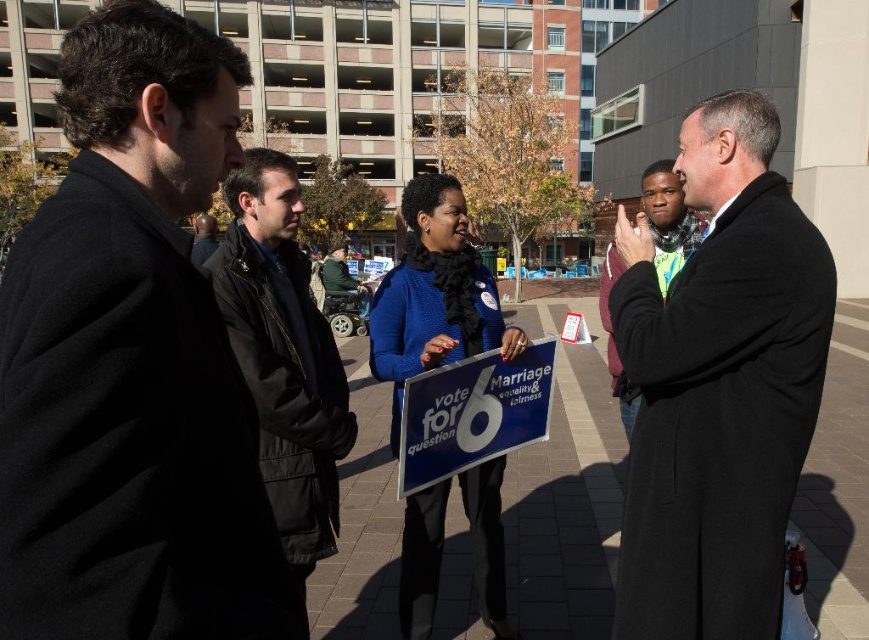
Question: Is black puffy jacket at center positioned behind dark gray wool coat at right?

Choices:
 (A) no
 (B) yes

Answer: (A)

Question: Does black puffy jacket at center appear on the left side of dark gray wool coat at right?

Choices:
 (A) yes
 (B) no

Answer: (A)

Question: Based on their relative distances, which object is farther from the blue plastic sign at center?

Choices:
 (A) dark wool coat at left
 (B) black puffy jacket at center
 (C) black wool coat at center
 (D) dark gray wool coat at right

Answer: (A)

Question: Is black wool coat at center positioned behind green fabric wheelchair at center?

Choices:
 (A) no
 (B) yes

Answer: (A)

Question: Based on their relative distances, which object is nearer to the dark gray wool coat at right?

Choices:
 (A) black wool coat at center
 (B) blue plastic sign at center
 (C) dark wool coat at left

Answer: (A)

Question: Which of the following is the closest to the observer?

Choices:
 (A) (495, 356)
 (B) (292, 320)

Answer: (B)